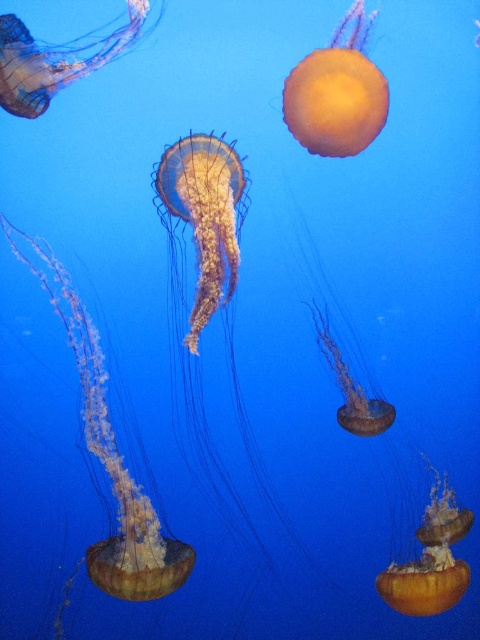
Question: From the image, what is the correct spatial relationship of translucent yellow jellyfish at center in relation to translucent orange jellyfish at lower right?

Choices:
 (A) left
 (B) right

Answer: (A)

Question: Which of the following is the farthest from the observer?

Choices:
 (A) (377, 424)
 (B) (456, 593)
 (C) (157, 179)
 (D) (15, 26)

Answer: (A)

Question: Does translucent orange jellyfish at lower right appear over translucent orange jellyfish at center?

Choices:
 (A) yes
 (B) no

Answer: (B)

Question: Which object is closer to the camera taking this photo?

Choices:
 (A) translucent yellow jellyfish at center
 (B) translucent yellow jellyfish at upper left

Answer: (B)

Question: Considering the real-world distances, which object is farthest from the translucent yellow jellyfish at left?

Choices:
 (A) translucent yellow jellyfish at center
 (B) translucent orange jellyfish at center
 (C) translucent orange jellyfish at lower right
 (D) translucent yellow jellyfish at upper left

Answer: (C)

Question: Can you confirm if translucent yellow jellyfish at center is positioned below translucent yellow jellyfish at upper left?

Choices:
 (A) no
 (B) yes

Answer: (B)